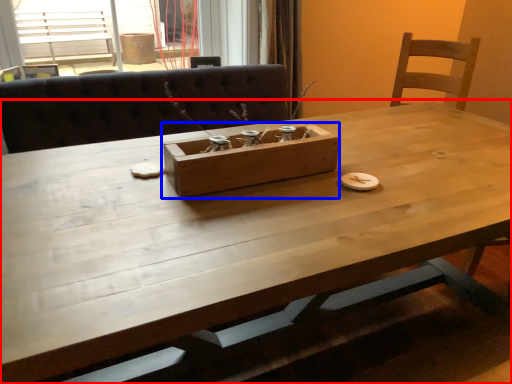
Question: Among these objects, which one is nearest to the camera, table (highlighted by a red box) or cardboard box (highlighted by a blue box)?

Choices:
 (A) table
 (B) cardboard box

Answer: (A)